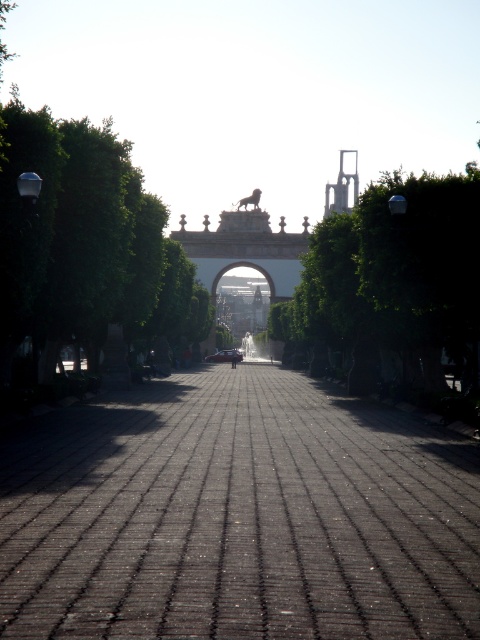
Does point (421, 362) come closer to viewer compared to point (218, 353)?

Yes, point (421, 362) is closer to viewer.

Is green leafy tree at center in front of shiny red car at center?

Yes, it is in front of shiny red car at center.

Which is behind, point (330, 369) or point (242, 356)?

Point (242, 356)

Where is `green leafy tree at center`? The height and width of the screenshot is (640, 480). green leafy tree at center is located at coordinates (392, 289).

Who is more distant from viewer, (25, 541) or (233, 358)?

Positioned behind is point (233, 358).

Where is `dark brick pathway at center`? The height and width of the screenshot is (640, 480). dark brick pathway at center is located at coordinates (237, 516).

Can you confirm if dark brick pathway at center is thinner than green leafy tree at center?

Correct, dark brick pathway at center's width is less than green leafy tree at center's.

Is point (210, 593) positioned after point (423, 380)?

No, it is not.

This screenshot has height=640, width=480. I want to click on dark brick pathway at center, so click(x=237, y=516).